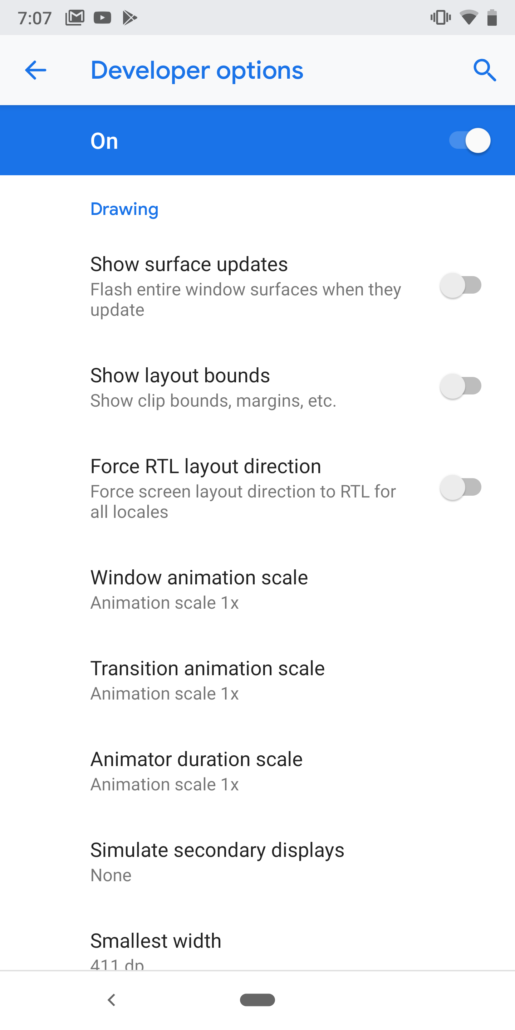
Locate an element on the screen. This screenshot has height=1030, width=515. wifi is located at coordinates click(x=464, y=19).